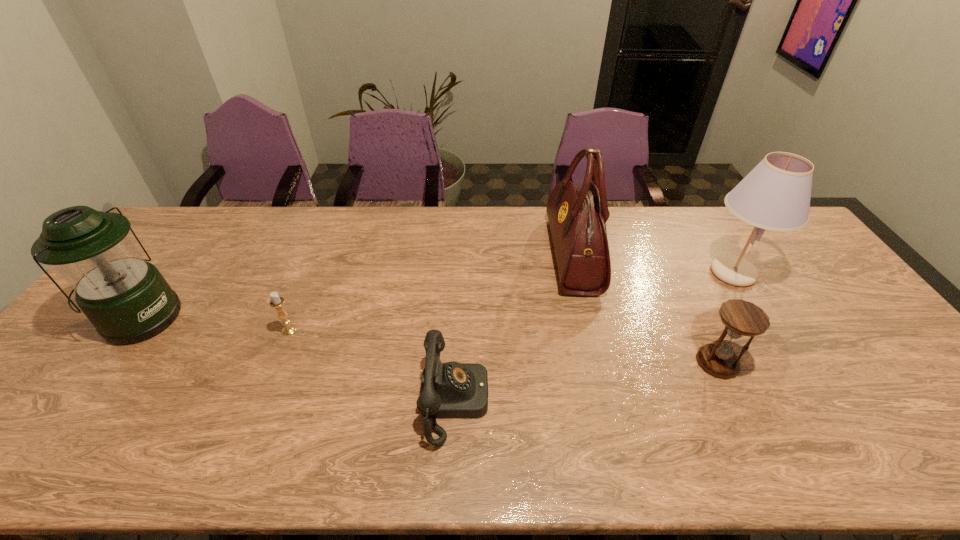
What are the coordinates of `vacant space at the right edge` in the screenshot? It's located at (815, 312).

Identify the location of free region at the far left corner of the desktop. This screenshot has width=960, height=540. (193, 245).

Image resolution: width=960 pixels, height=540 pixels. Identify the location of vacant space at the near right corner of the desktop. (936, 470).

In order to click on vacant area that lies between the telephone and the second object from left to right in this screenshot , I will do `click(372, 366)`.

The height and width of the screenshot is (540, 960). I want to click on free space that is in between the lantern and the third object from right to left, so click(x=357, y=286).

Locate an element on the screen. The width and height of the screenshot is (960, 540). unoccupied position between the leftmost object and the handbag is located at coordinates (357, 286).

The width and height of the screenshot is (960, 540). Identify the location of empty space between the candle holder and the third object from right to left. (431, 293).

Find the location of a particular element. This screenshot has height=540, width=960. empty location between the handbag and the lantern is located at coordinates (357, 286).

At what (x,y) coordinates should I click in order to perform the action: click on free area in between the telephone and the candle holder. Please return your answer as a coordinate pair (x, y). This screenshot has height=540, width=960. Looking at the image, I should click on (372, 366).

Identify the location of vacant region between the handbag and the telephone. (514, 328).